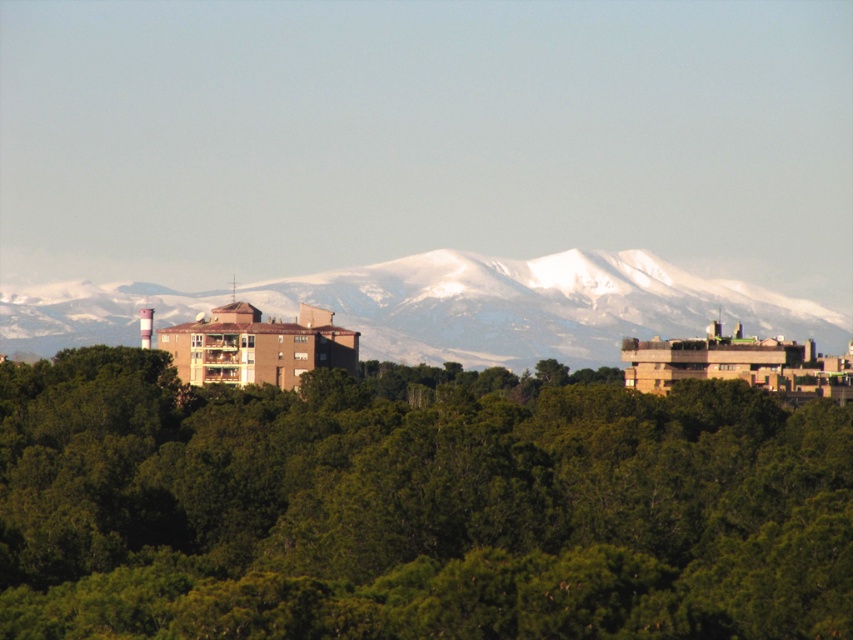
Is point (165, 572) in front of point (570, 323)?

Yes, point (165, 572) is closer to viewer.

Which of these two, green leafy trees at center or snowy white mountain range at upper center, stands shorter?

snowy white mountain range at upper center

Is point (399, 433) positioned behind point (16, 316)?

No, it is not.

The width and height of the screenshot is (853, 640). I want to click on green leafy trees at center, so click(413, 509).